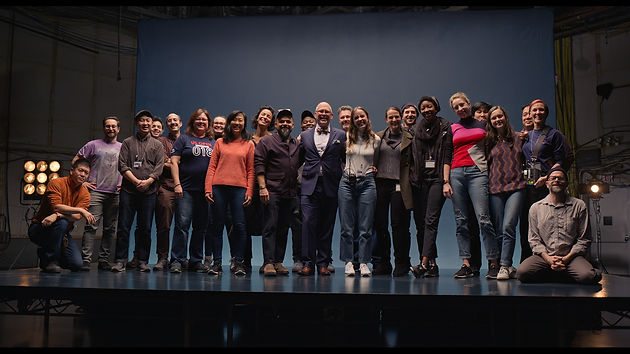
Locate an element on the screen. Image resolution: width=630 pixels, height=354 pixels. lights is located at coordinates (29, 164), (26, 177), (26, 190), (38, 187), (40, 178), (42, 165), (54, 165), (53, 176), (595, 187).